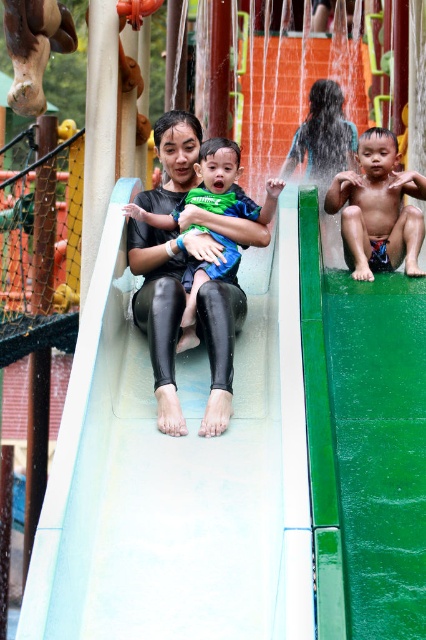
Question: Does skinny boy at center appear over matte black swimwear at left?

Choices:
 (A) yes
 (B) no

Answer: (A)

Question: From the image, what is the correct spatial relationship of matte black swimwear at left in relation to matte black wetsuit at center?

Choices:
 (A) below
 (B) above

Answer: (A)

Question: In this image, where is white smooth slide at center located relative to skinny boy at center?

Choices:
 (A) above
 (B) below

Answer: (B)

Question: Which is nearer to the matte black swimwear at left?

Choices:
 (A) skinny boy at center
 (B) matte black wetsuit at center

Answer: (A)

Question: Considering the real-world distances, which object is farthest from the white smooth slide at center?

Choices:
 (A) matte black swimwear at left
 (B) matte black wetsuit at center
 (C) skinny boy at center

Answer: (B)

Question: Which point appears farthest from the camera in this image?

Choices:
 (A) (412, 188)
 (B) (229, 280)

Answer: (A)